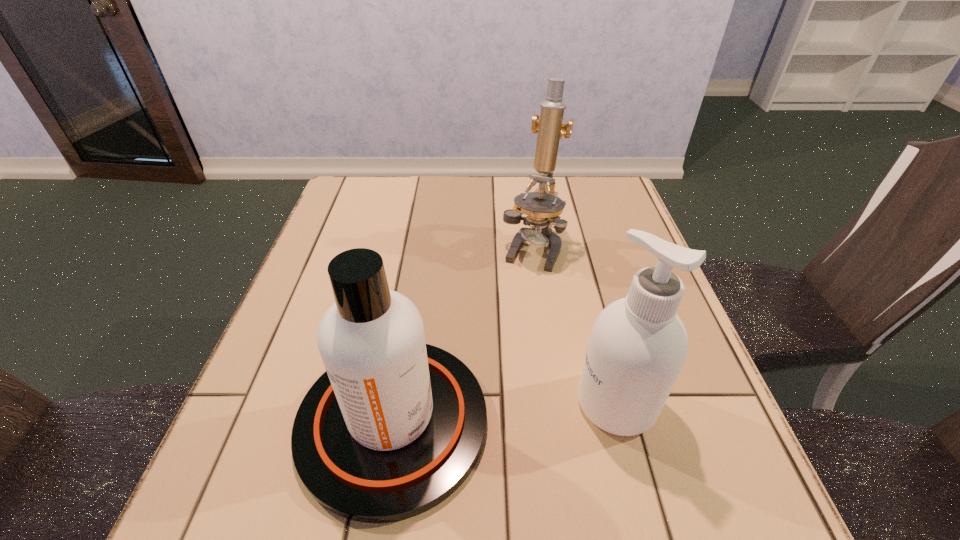
At what (x,y) coordinates should I click in order to perform the action: click on object that is at the right edge. Please return your answer as a coordinate pair (x, y). This screenshot has width=960, height=540. Looking at the image, I should click on coord(638,345).

Locate an element on the screen. object present at the near left corner is located at coordinates (394, 426).

Locate an element on the screen. This screenshot has height=540, width=960. vacant space at the far edge is located at coordinates (511, 192).

In the image, there is a desktop. Identify the location of vacant space at the left edge. (283, 447).

The height and width of the screenshot is (540, 960). In order to click on vacant space at the right edge in this screenshot , I will do click(x=708, y=383).

This screenshot has width=960, height=540. Identify the location of vacant region at the far left corner of the desktop. (353, 194).

In the image, there is a desktop. At what (x,y) coordinates should I click in order to perform the action: click on vacant area at the near left corner. Please return your answer as a coordinate pair (x, y). Image resolution: width=960 pixels, height=540 pixels. Looking at the image, I should click on (185, 528).

In the image, there is a desktop. Where is `vacant region at the far right corner`? The width and height of the screenshot is (960, 540). vacant region at the far right corner is located at coordinates (595, 196).

The height and width of the screenshot is (540, 960). In order to click on free space between the leftmost object and the microscope in this screenshot , I will do `click(463, 335)`.

This screenshot has width=960, height=540. I want to click on vacant point located between the right cleansing agent and the left cleansing agent, so click(x=505, y=412).